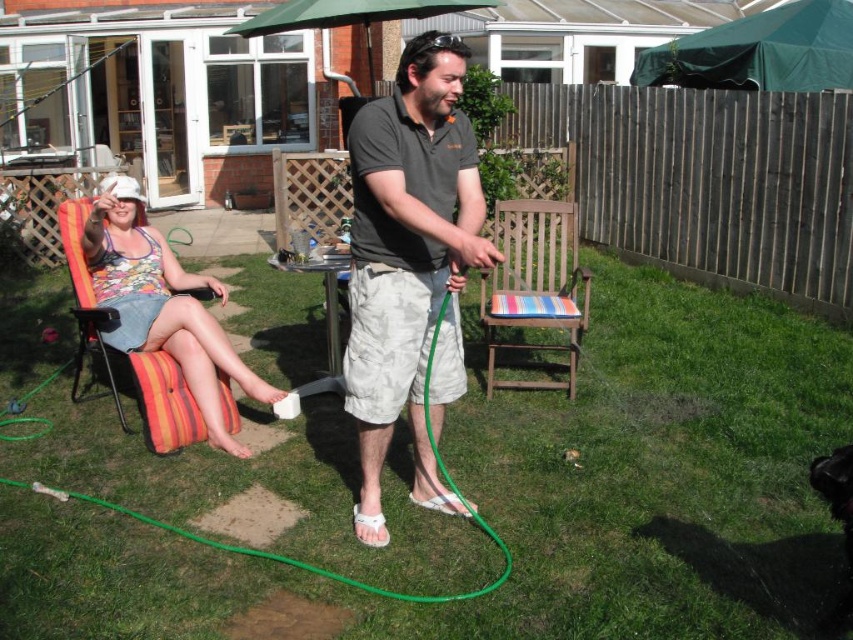
You are a painter standing in the backyard and want to paint the dark gray cotton shirt at center and the striped fabric chair at center. Which object should you focus on first if you want to paint the taller object first?

The dark gray cotton shirt at center is taller than the striped fabric chair at center, so you should focus on painting the dark gray cotton shirt at center first.

You are standing in the backyard and want to move to the striped fabric chair at left. Which direction should you move relative to your current position?

The striped fabric chair at left is located at point (x=166, y=403), so you should move to the left direction to reach it.